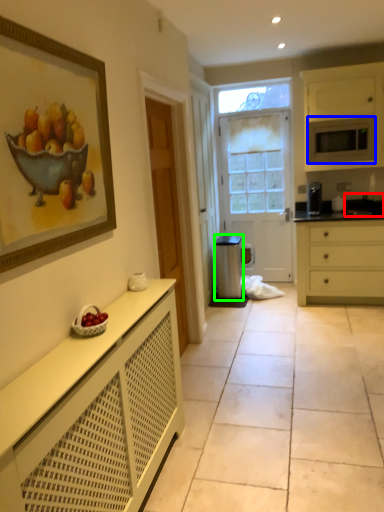
Question: Estimate the real-world distances between objects in this image. Which object is farther from sink (highlighted by a red box), microwave oven (highlighted by a blue box) or appliance (highlighted by a green box)?

Choices:
 (A) microwave oven
 (B) appliance

Answer: (B)